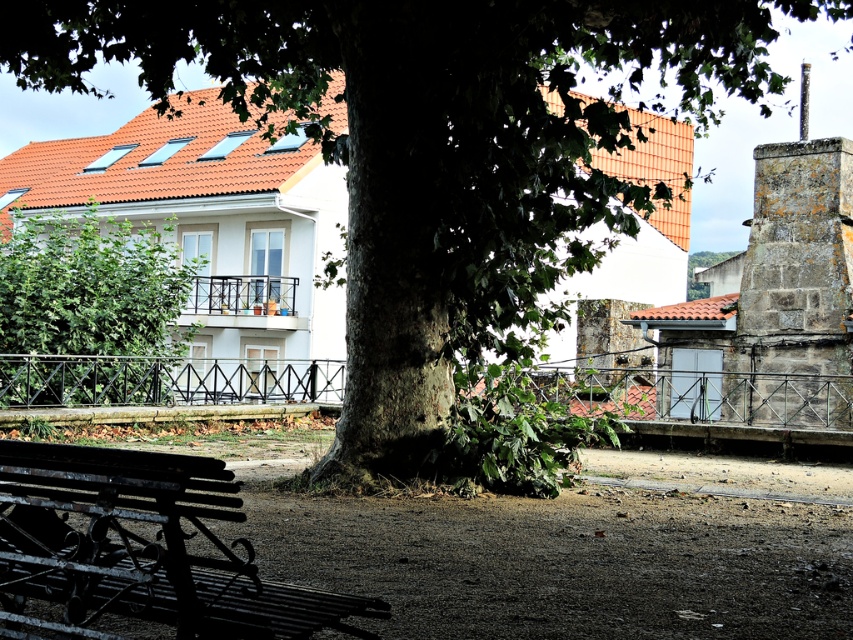
You are standing at the center of the image and want to walk towards the gray stone chimney at upper right. Is the rusty metal bench at lower left blocking your path?

The rusty metal bench at lower left is in front of the gray stone chimney at upper right, so it would block your path to the chimney.

You are standing in the park and see the rusty metal bench at lower left and the green leafy tree at left. Which object is nearer to you?

The rusty metal bench at lower left is closer to the viewer than the green leafy tree at left.